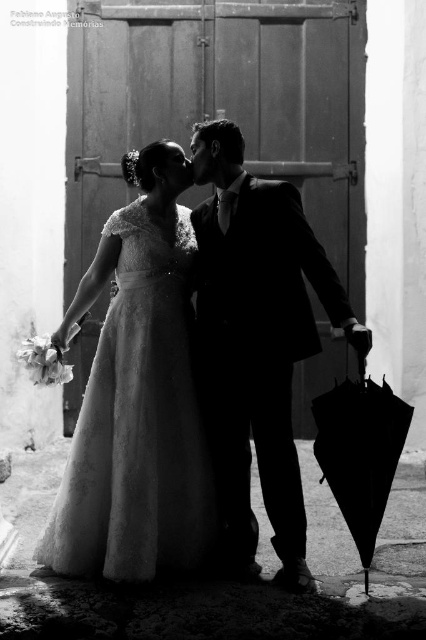
You are a photographer standing in front of the scene. You need to adjust the camera focus so that both the satin white gown at center and the black matte umbrella at lower right are in focus. Which object should you focus on first to ensure both are sharp?

The satin white gown at center is taller than the black matte umbrella at lower right. To ensure both are in focus, you should focus on the satin white gown at center first, as it is closer to the camera, allowing the depth of field to cover the umbrella behind it.

You are a photographer who needs to adjust the camera focus. Since the satin white gown at center and the satin black suit at center are both in the frame, which one should you focus on first if you want to ensure the shorter one is sharp?

The satin white gown at center is shorter than the satin black suit at center, so you should focus on the satin white gown at center first to ensure it is sharp.

You are a photographer trying to capture the couple in the scene. You want to ensure both the satin white gown at center and the black matte umbrella at lower right are clearly visible in your shot. Given their sizes, which object should you focus on first to ensure proper framing?

The satin white gown at center is bigger than the black matte umbrella at lower right, so you should focus on the satin white gown at center first to ensure it is properly framed before adjusting for the smaller umbrella.